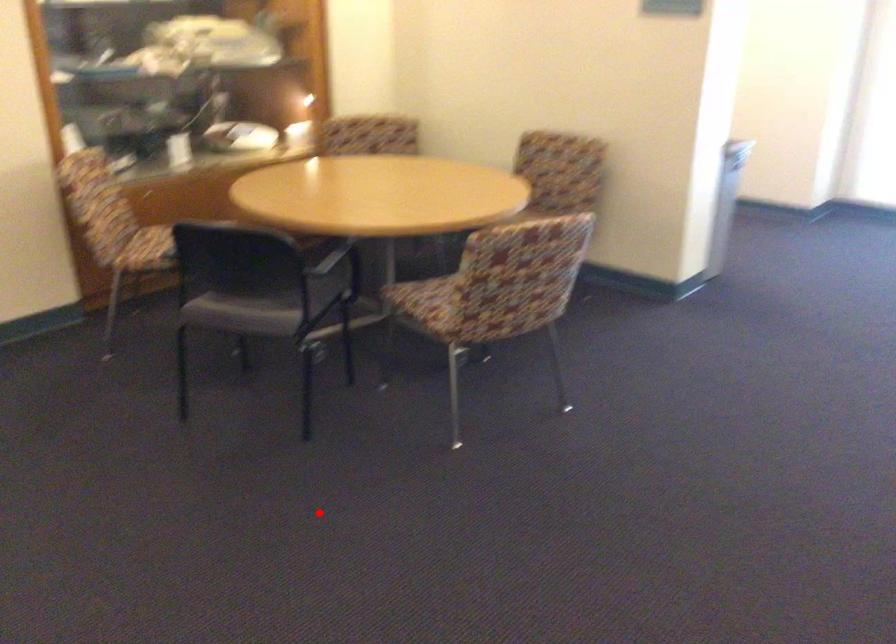
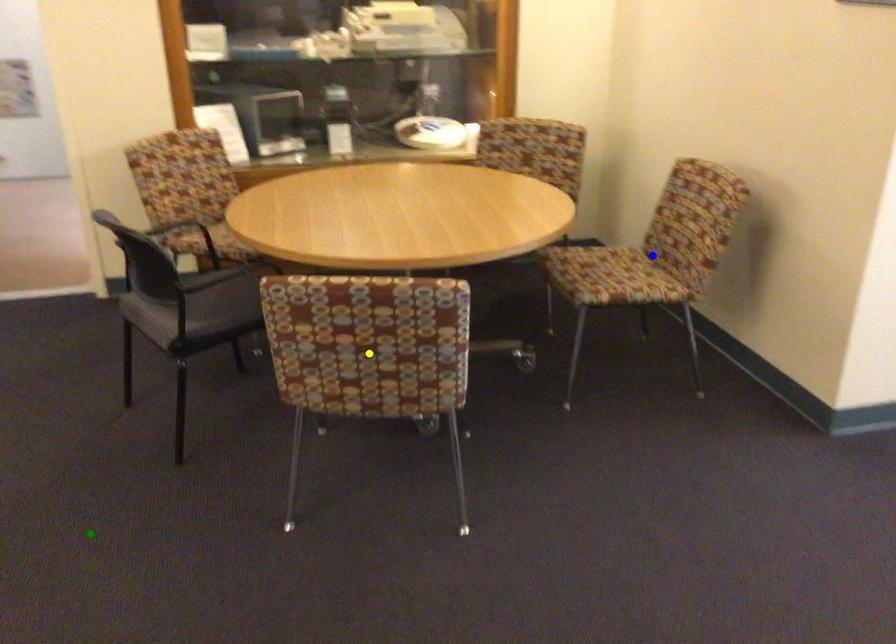
Question: I am providing you with two images of the same scene from different viewpoints. A red point is marked on the first image. You are given multiple points on the second image. Which mark in image 2 goes with the point in image 1?

Choices:
 (A) blue point
 (B) yellow point
 (C) green point

Answer: (C)